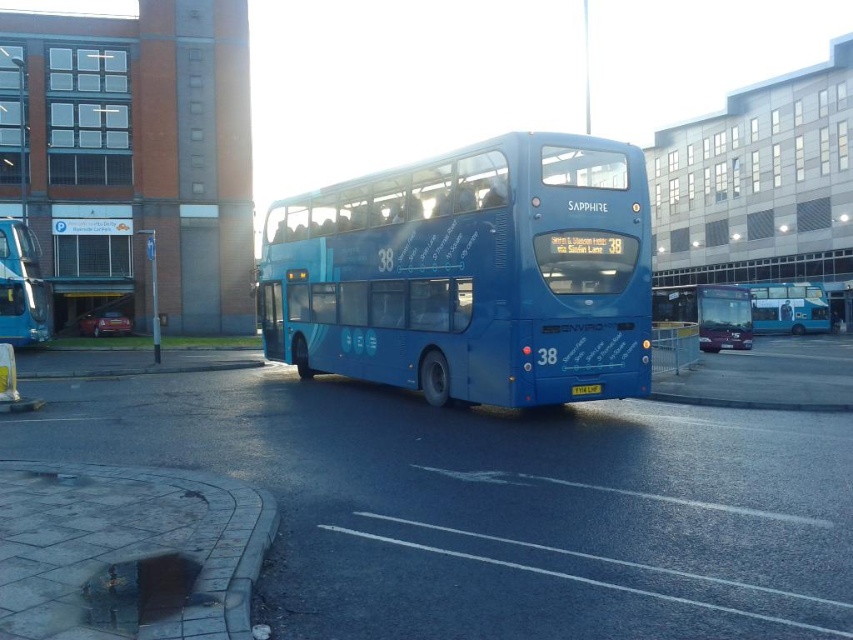
Find the location of a particular element. This screenshot has height=640, width=853. blue matte/deck bus at center is located at coordinates (469, 273).

Does blue matte/deck bus at center appear over yellow metallic license plate at center?

Yes.

Is point (383, 173) closer to viewer compared to point (596, 388)?

That is False.

Where is `blue matte/deck bus at center`? The image size is (853, 640). blue matte/deck bus at center is located at coordinates (469, 273).

Can you confirm if matte blue bus at left is bigger than blue matte bus at center?

Incorrect, matte blue bus at left is not larger than blue matte bus at center.

Which is more to the right, matte blue bus at left or blue matte bus at center?

blue matte bus at center is more to the right.

Who is more distant from viewer, [16,332] or [764,332]?

The point [764,332] is behind.

You are a GUI agent. You are given a task and a screenshot of the screen. Output one action in this format:
    pyautogui.click(x=<x>, y=<y>)
    Task: Click on the matte blue bus at left
    This screenshot has width=853, height=640.
    Given the screenshot: What is the action you would take?
    (21, 288)

Is point (303, 376) in front of point (4, 284)?

That is True.

Can you confirm if blue matte/deck bus at center is positioned below matte blue bus at left?

Yes.

The height and width of the screenshot is (640, 853). In order to click on blue matte/deck bus at center in this screenshot , I will do `click(469, 273)`.